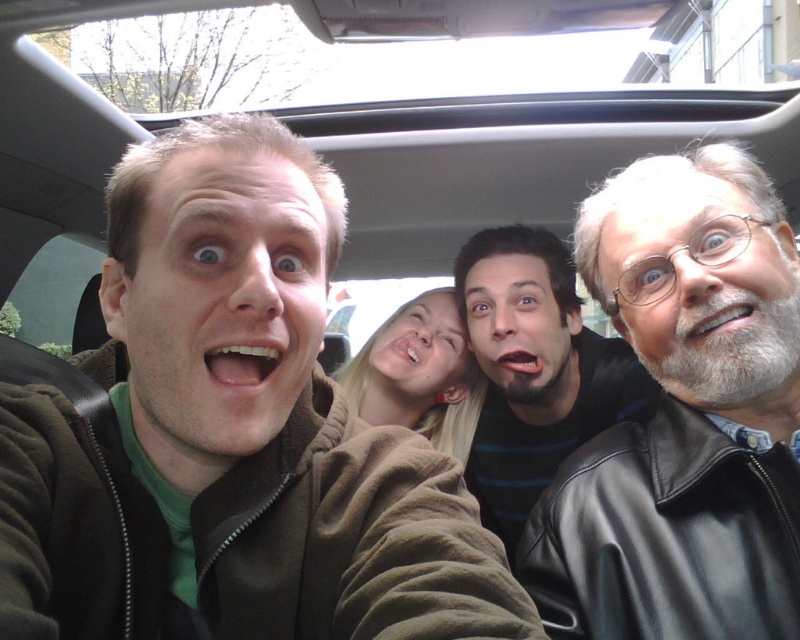
Who is more forward, (694, 580) or (470, 326)?

Point (694, 580)

Where is `black leather jacket at right`? black leather jacket at right is located at coordinates (684, 417).

The width and height of the screenshot is (800, 640). What are the coordinates of `black leather jacket at right` in the screenshot? It's located at (684, 417).